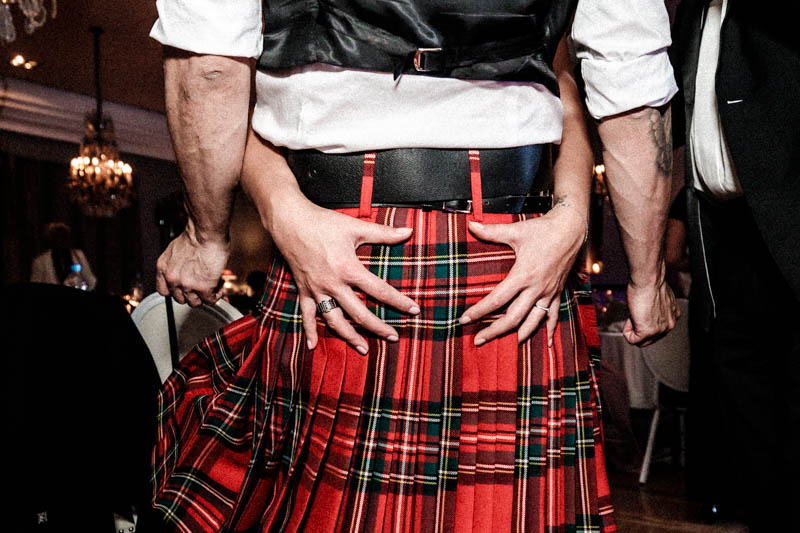
Find the location of a particular element. The image size is (800, 533). small round golden white lights on chandelier is located at coordinates (76, 164), (97, 161), (125, 167).